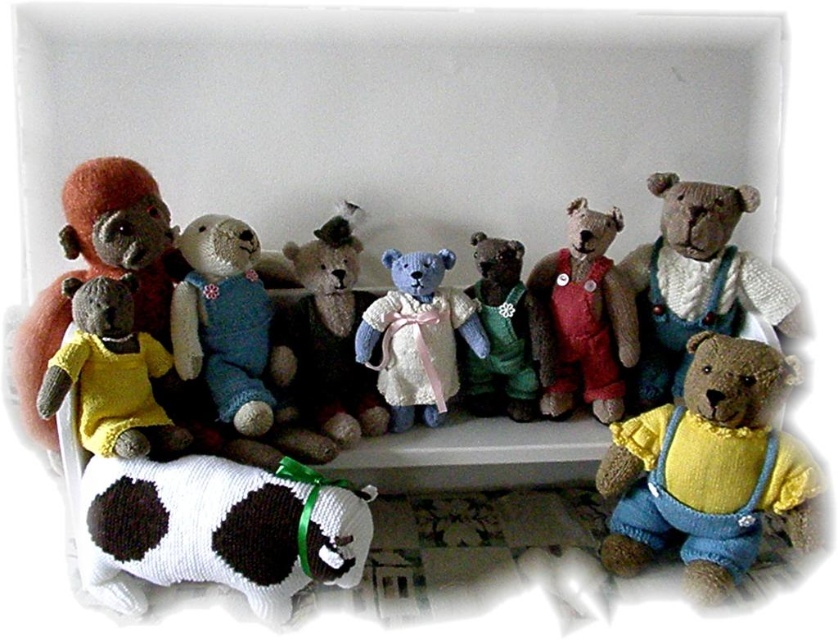
You are a photographer standing 5 feet away from the shelf where the knitted beige bear at center is displayed. Can you reach out and touch the bear without moving your position?

The knitted beige bear at center is 4.02 feet from camera, so yes, you can reach out and touch the bear without moving your position since you are only 5 feet away and the bear is closer than that.

You are organizing a teddy bear display and need to ensure that the knitted yellow sweater at center and the knitted wool teddy bear at center fit within a 12 inch tall display case. Given their sizes, will both items fit vertically?

The knitted yellow sweater at center is not as tall as the knitted wool teddy bear at center. If the teddy bear is under 12 inches tall, both would fit. However, if the teddy bear exceeds 12 inches, neither would fit. The sweater alone might fit even if the teddy is too tall, but without exact measurements, we can only compare their relative heights.